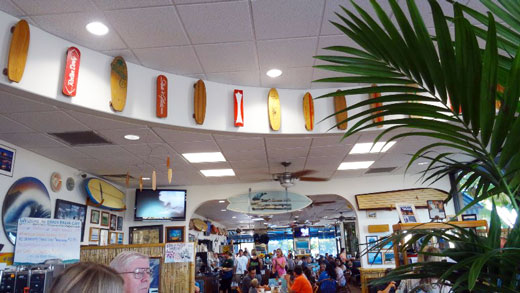
Locate an element on the screen. This screenshot has height=293, width=520. fan is located at coordinates (292, 181).